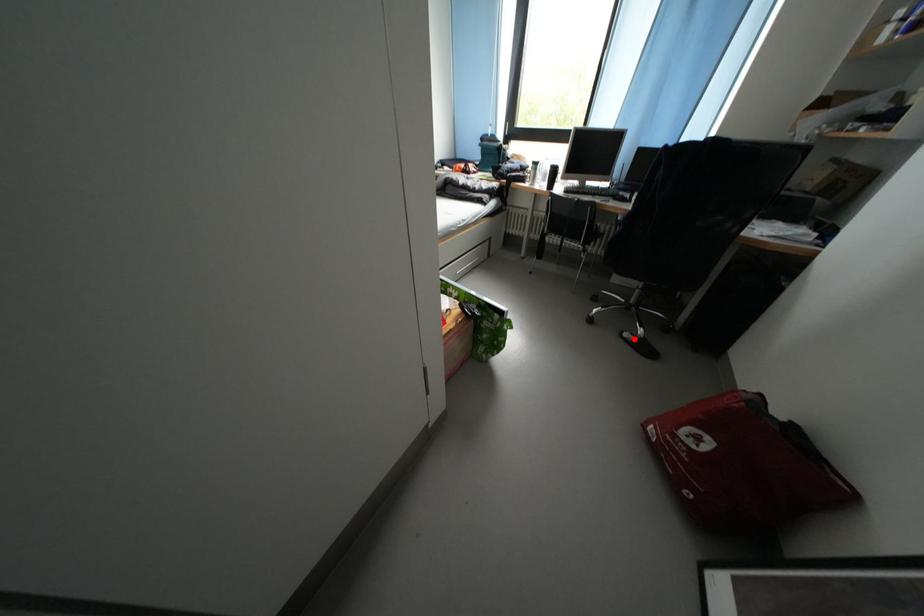
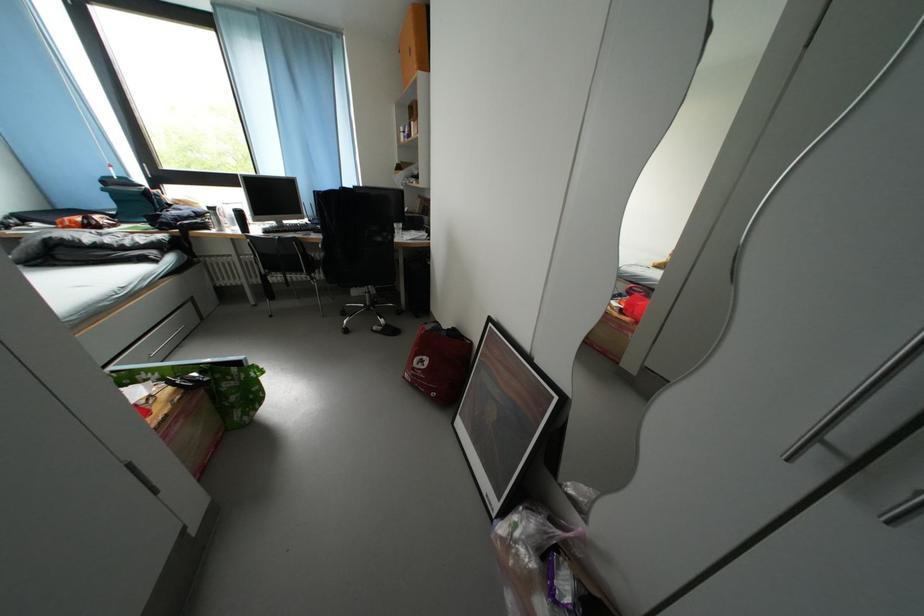
Question: I am providing you with two images of the same scene from different viewpoints. In image1, a red point is highlighted. Considering the same 3D point in image2, which of the following is correct?

Choices:
 (A) It is closer
 (B) It is farther

Answer: (B)